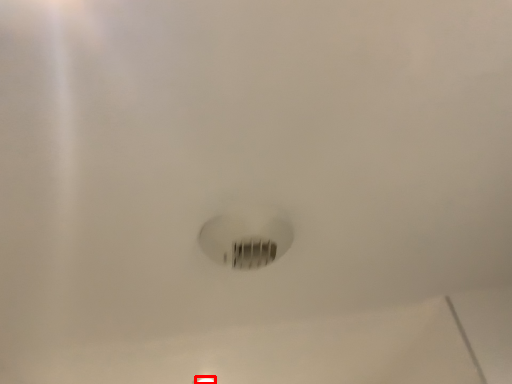
Question: In this image, where is light fixture (annotated by the red box) located relative to light bulb?

Choices:
 (A) right
 (B) left

Answer: (B)